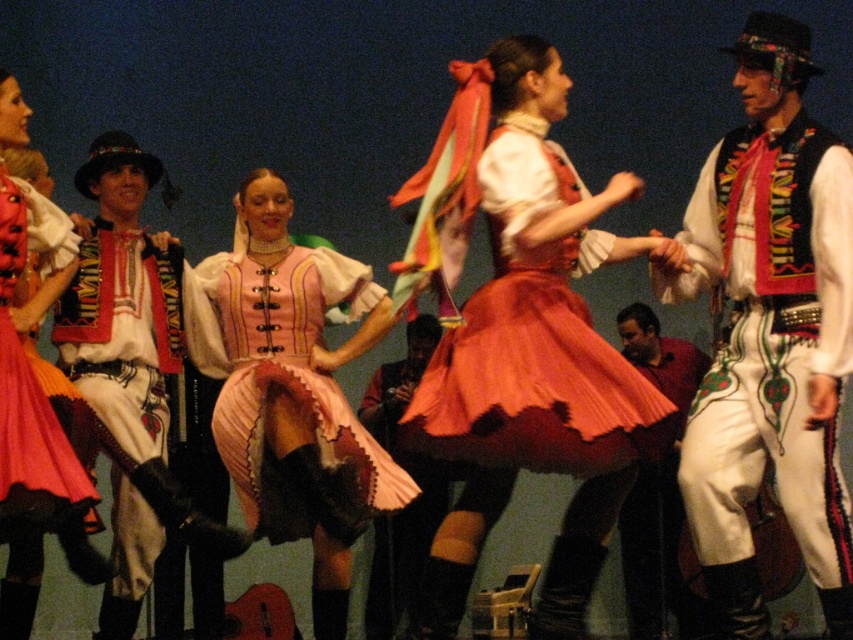
Who is more forward, [250,456] or [4,397]?

Point [4,397] is more forward.

Is pink satin dress at center closer to camera compared to matte black dress at left?

No, pink satin dress at center is further to the viewer.

The width and height of the screenshot is (853, 640). In order to click on pink satin dress at center in this screenshot , I will do `click(297, 392)`.

Is white satin vest at right to the left of pink satin dress at center from the viewer's perspective?

In fact, white satin vest at right is to the right of pink satin dress at center.

Based on the photo, is white satin vest at right positioned behind pink satin dress at center?

No.

Between point (776, 465) and point (244, 444), which one is positioned in front?

Point (776, 465)

At what (x,y) coordinates should I click in order to perform the action: click on white satin vest at right. Please return your answer as a coordinate pair (x, y). This screenshot has height=640, width=853. Looking at the image, I should click on (769, 339).

Is white satin vest at right bigger than matte black dress at left?

Actually, white satin vest at right might be smaller than matte black dress at left.

Is point (730, 211) closer to viewer compared to point (33, 198)?

Yes.

Between point (805, 241) and point (42, 499), which one is positioned in front?

Point (805, 241) is in front.

The height and width of the screenshot is (640, 853). Find the location of `white satin vest at right`. white satin vest at right is located at coordinates (769, 339).